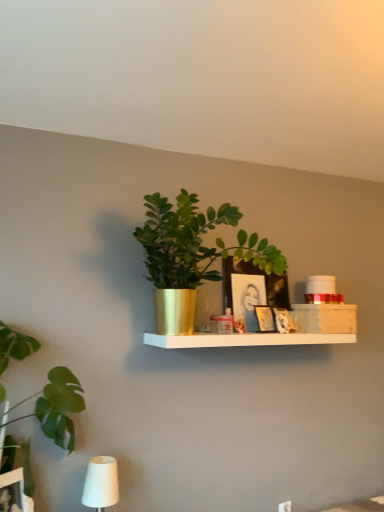
Question: Is matte black picture frame at center, acting as the 2th picture frame starting from the back, in front of or behind gold metallic plant pot at center, which ranks as the 1th houseplant in right-to-left order, in the image?

Choices:
 (A) front
 (B) behind

Answer: (B)

Question: In terms of width, does matte black picture frame at center, which is the third picture frame in front-to-back order, look wider or thinner when compared to gold metallic plant pot at center, the 2th houseplant from the left?

Choices:
 (A) wide
 (B) thin

Answer: (B)

Question: Which object is the farthest from the matte black picture frame at center, acting as the 2th picture frame starting from the back?

Choices:
 (A) matte black picture frame at upper center, the 4th picture frame in the front-to-back sequence
 (B) gold metallic plant pot at center, the 2th houseplant from the left
 (C) wooden picture frame at center, placed as the 4th picture frame when sorted from back to front
 (D) green leafy plant at left, arranged as the 2th houseplant when viewed from the right
 (E) matte black picture frame at center, the 2th picture frame in the front-to-back sequence

Answer: (D)

Question: Which object is the farthest from the white matte table lamp at lower left?

Choices:
 (A) green leafy plant at left, arranged as the 2th houseplant when viewed from the right
 (B) matte black picture frame at upper center, the 4th picture frame in the front-to-back sequence
 (C) gold metallic plant pot at center, which ranks as the 1th houseplant in right-to-left order
 (D) matte black picture frame at center, the 2th picture frame in the front-to-back sequence
 (E) wooden picture frame at center, placed as the 4th picture frame when sorted from back to front

Answer: (B)